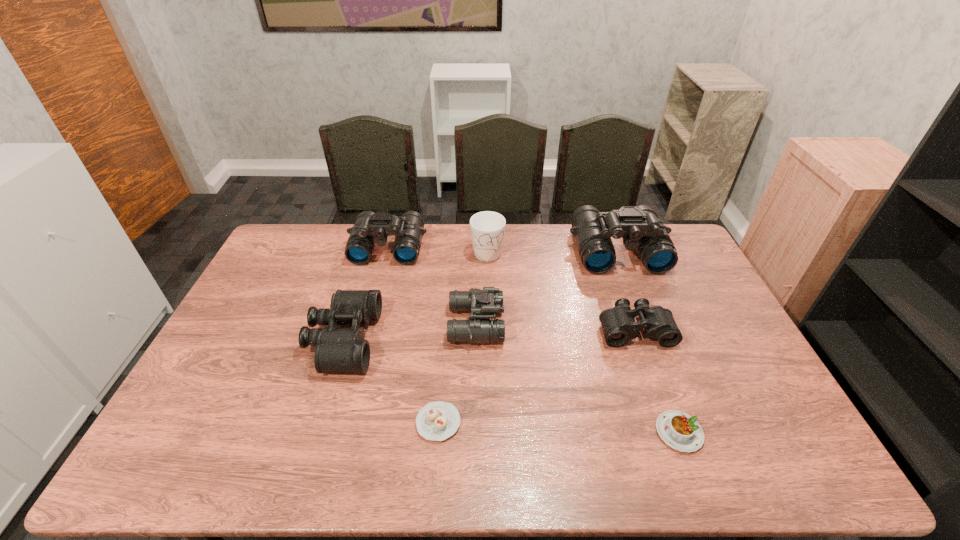
Locate an element on the screen. This screenshot has width=960, height=540. cupcake is located at coordinates (437, 421).

This screenshot has width=960, height=540. I want to click on pudding, so click(x=677, y=429).

Where is `vacant space located through the lenses of the rightmost blue binoculars`? This screenshot has width=960, height=540. vacant space located through the lenses of the rightmost blue binoculars is located at coordinates (643, 316).

Identify the location of vacant space located 0.230m through the lenses of the second tallest binoculars. pyautogui.click(x=372, y=312).

The height and width of the screenshot is (540, 960). I want to click on free region located 0.400m on the side of the mug with the handle, so click(490, 351).

Identify the location of blank space located 0.130m through the lenses of the nearest blue binoculars. This screenshot has width=960, height=540. (544, 324).

Locate an element on the screen. The height and width of the screenshot is (540, 960). vacant space situated at the eyepieces of the left black binoculars is located at coordinates (488, 339).

Locate an element on the screen. The height and width of the screenshot is (540, 960). vacant area located at the eyepieces of the third shortest object is located at coordinates (664, 413).

The height and width of the screenshot is (540, 960). Identify the location of vacant point located on the left of the cupcake. (302, 422).

The image size is (960, 540). What are the coordinates of `free region located on the right of the pudding` in the screenshot? It's located at (778, 433).